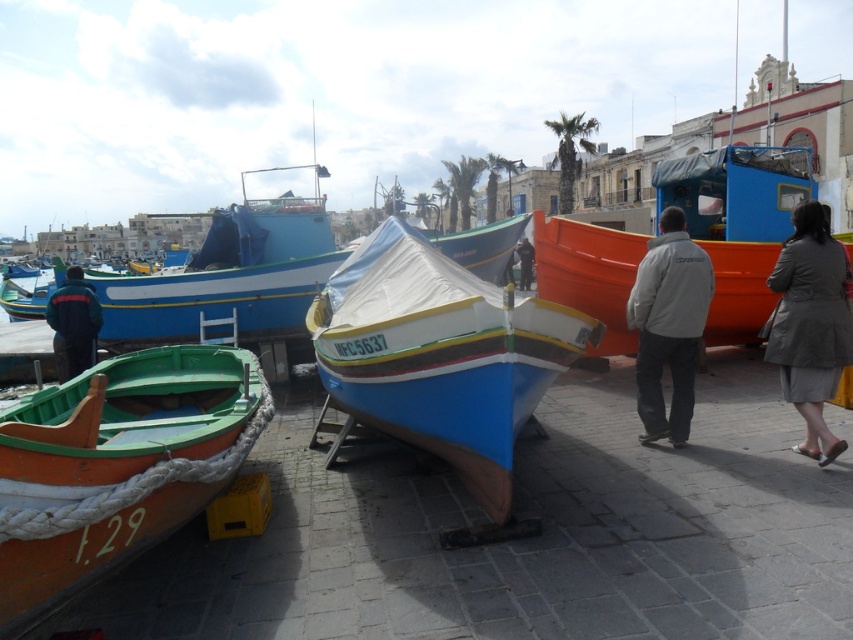
Question: Which of the following is the closest to the observer?

Choices:
 (A) (643, 291)
 (B) (782, 237)

Answer: (A)

Question: Which object appears farthest from the camera in this image?

Choices:
 (A) orange matte boat at center
 (B) dark gray jacket at center

Answer: (B)

Question: Which object appears farthest from the camera in this image?

Choices:
 (A) dark gray jacket at center
 (B) gray fabric coat at lower right
 (C) gray fleece jacket at center
 (D) dark blue jacket at left

Answer: (A)

Question: Is green polished wood boat at lower left closer to camera compared to gray fabric coat at lower right?

Choices:
 (A) no
 (B) yes

Answer: (B)

Question: Is gray fleece jacket at center to the right of dark gray jacket at center from the viewer's perspective?

Choices:
 (A) yes
 (B) no

Answer: (B)

Question: Does green polished wood boat at lower left have a lesser width compared to dark gray jacket at center?

Choices:
 (A) yes
 (B) no

Answer: (B)